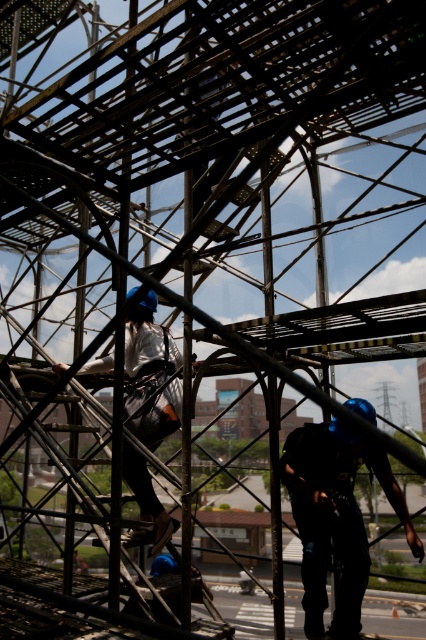
Question: Which is nearer to the metallic scaffolding at center?

Choices:
 (A) matte white shirt at center
 (B) shiny blue helmet at center

Answer: (B)

Question: Which of the following is the farthest from the observer?

Choices:
 (A) (164, 349)
 (B) (308, 604)

Answer: (B)

Question: Does metallic scaffolding at center come in front of matte white shirt at center?

Choices:
 (A) yes
 (B) no

Answer: (A)

Question: Does metallic scaffolding at center have a lesser width compared to matte white shirt at center?

Choices:
 (A) no
 (B) yes

Answer: (A)

Question: Can you confirm if shiny blue helmet at center is positioned to the left of matte white shirt at center?

Choices:
 (A) yes
 (B) no

Answer: (B)

Question: Considering the real-world distances, which object is farthest from the matte white shirt at center?

Choices:
 (A) metallic scaffolding at center
 (B) shiny blue helmet at center

Answer: (A)